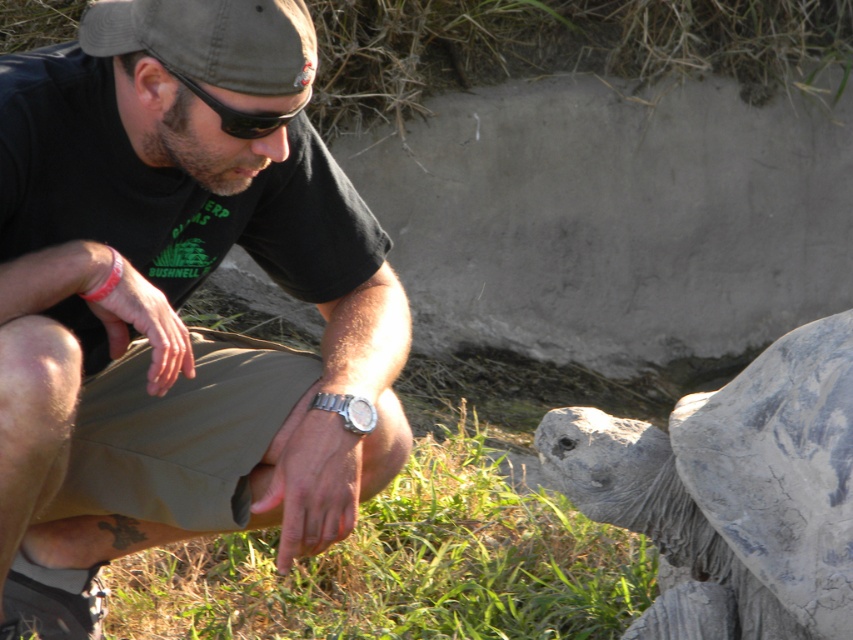
Based on the photo, you are a photographer trying to capture both the green fabric cap at upper left and the black rubber goggles at upper center in a single frame. Based on their positions, which object should you adjust your camera to focus on first to ensure both are in the frame?

You should focus on the black rubber goggles at upper center first because the green fabric cap at upper left is to the left of it, so adjusting the camera to include the cap on the left side will naturally include the goggles on the right side as well.

The man is wearing a silver metallic watch at lower center and has a gray rough shell at lower right nearby. Which object is wider?

The gray rough shell at lower right is wider than the silver metallic watch at lower center.

You are a wildlife photographer aiming to capture the gray rough shell at lower right and the black rubber goggles at upper center in the same frame. Which object should you focus on first if you want to ensure both are in focus without moving the camera?

The gray rough shell at lower right should be focused on first because it is wider than the black rubber goggles at upper center, so focusing on the larger object first increases the chances of both being in focus.